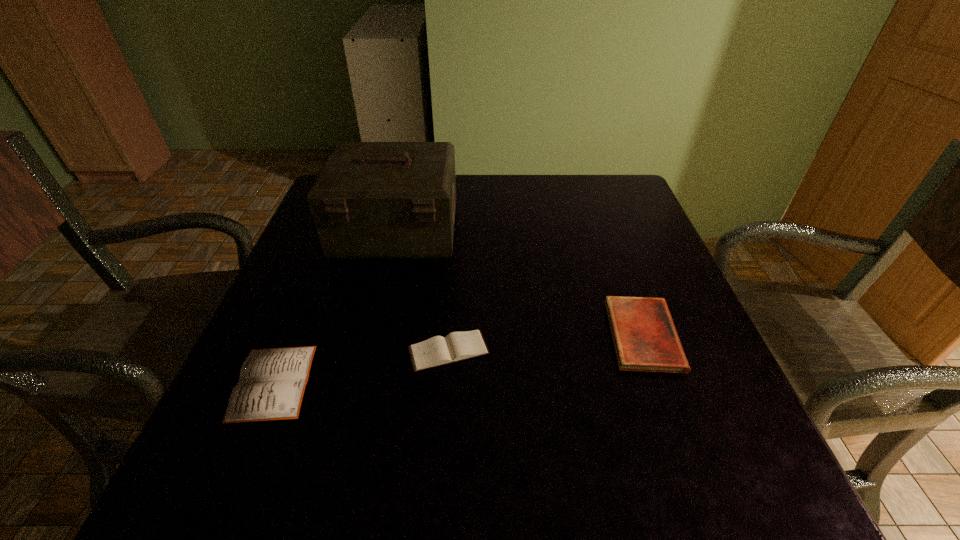
You are a GUI agent. You are given a task and a screenshot of the screen. Output one action in this format:
    pyautogui.click(x=<x>, y=<y>)
    Task: Click on the free space between the leftmost diary and the first-aid kit
    The width and height of the screenshot is (960, 540).
    Given the screenshot: What is the action you would take?
    pyautogui.click(x=335, y=307)

Locate an element on the screen. This screenshot has height=540, width=960. free space between the second diary from left to right and the first-aid kit is located at coordinates [422, 291].

What are the coordinates of `empty space between the second diary from left to right and the rightmost object` in the screenshot? It's located at (546, 343).

Identify the location of free space that is in between the rightmost object and the second diary from right to left. (546, 343).

The width and height of the screenshot is (960, 540). Find the location of `empty location between the rightmost object and the second diary from left to right`. empty location between the rightmost object and the second diary from left to right is located at coordinates (546, 343).

This screenshot has width=960, height=540. What are the coordinates of `free space between the second diary from left to right and the first-aid kit` in the screenshot? It's located at (422, 291).

Find the location of a particular element. The image size is (960, 540). blank region between the farthest object and the rightmost diary is located at coordinates (519, 283).

Where is `object that is the third nearest to the rightmost object`? The image size is (960, 540). object that is the third nearest to the rightmost object is located at coordinates (272, 382).

Point out which object is positioned as the third nearest to the tallest object. Please provide its 2D coordinates. Your answer should be formatted as a tuple, i.e. [(x, y)], where the tuple contains the x and y coordinates of a point satisfying the conditions above.

[(645, 339)]

Identify which diary is the second closest to the leftmost diary. Please provide its 2D coordinates. Your answer should be formatted as a tuple, i.e. [(x, y)], where the tuple contains the x and y coordinates of a point satisfying the conditions above.

[(645, 339)]